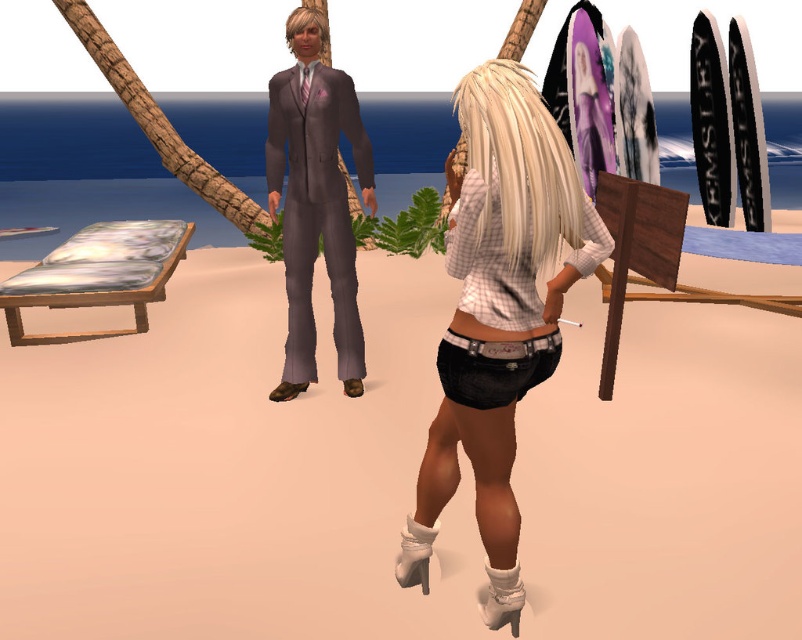
Question: Is beige sand at center further to the viewer compared to matte gray suit at center?

Choices:
 (A) yes
 (B) no

Answer: (B)

Question: Is denim shorts at center positioned before matte gray suit at center?

Choices:
 (A) no
 (B) yes

Answer: (B)

Question: Among these points, which one is nearest to the camera?

Choices:
 (A) (144, 493)
 (B) (334, 266)

Answer: (A)

Question: Which point is farther to the camera?

Choices:
 (A) denim shorts at center
 (B) beige sand at center

Answer: (B)

Question: Which of the following is the closest to the observer?

Choices:
 (A) (452, 400)
 (B) (321, 93)
 (C) (521, 424)

Answer: (A)

Question: From the image, what is the correct spatial relationship of beige sand at center in relation to matte gray suit at center?

Choices:
 (A) below
 (B) above

Answer: (A)